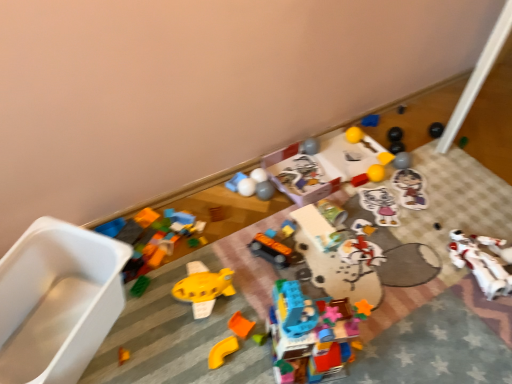
Identify the location of free space in front of matte gray ball at center, which is the 7th toy in left-to-right order. (260, 225).